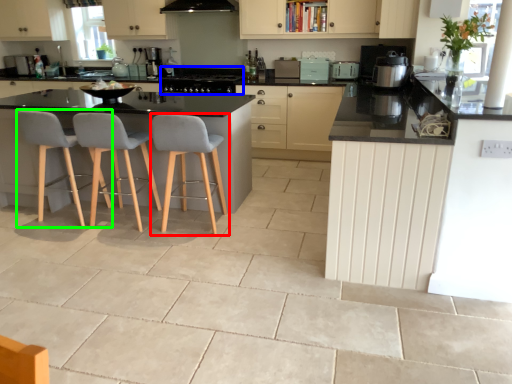
Question: Based on their relative distances, which object is nearer to chair (highlighted by a red box)? Choose from appliance (highlighted by a blue box) and chair (highlighted by a green box).

Choices:
 (A) appliance
 (B) chair

Answer: (B)